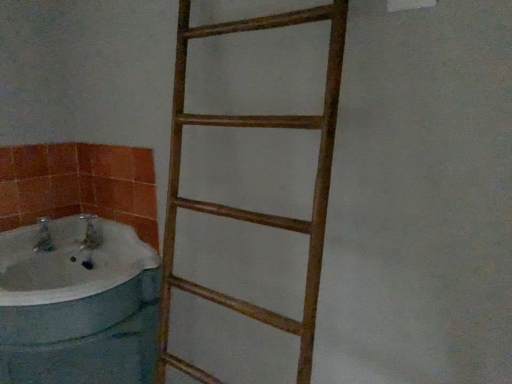
Question: From the image's perspective, is wooden ladder at center located above or below white glossy bathtub at left?

Choices:
 (A) below
 (B) above

Answer: (B)

Question: Looking at their shapes, would you say wooden ladder at center is wider or thinner than white glossy bathtub at left?

Choices:
 (A) wide
 (B) thin

Answer: (B)

Question: From a real-world perspective, is wooden ladder at center physically located above or below white glossy bathtub at left?

Choices:
 (A) below
 (B) above

Answer: (B)

Question: Looking at the image, does white glossy bathtub at left seem bigger or smaller compared to wooden ladder at center?

Choices:
 (A) big
 (B) small

Answer: (B)

Question: From a real-world perspective, relative to wooden ladder at center, is white glossy bathtub at left vertically above or below?

Choices:
 (A) above
 (B) below

Answer: (B)

Question: Considering the positions of white glossy bathtub at left and wooden ladder at center in the image, is white glossy bathtub at left taller or shorter than wooden ladder at center?

Choices:
 (A) tall
 (B) short

Answer: (B)

Question: Looking at their shapes, would you say white glossy bathtub at left is wider or thinner than wooden ladder at center?

Choices:
 (A) thin
 (B) wide

Answer: (B)